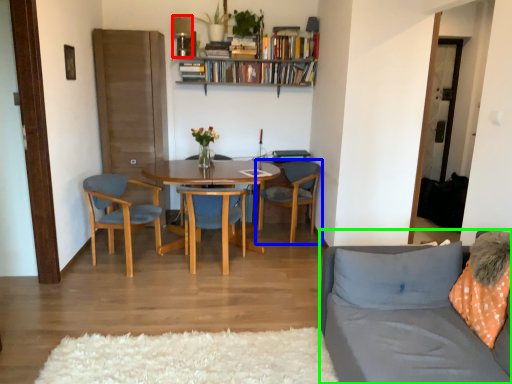
Question: Which object is positioned farthest from lamp (highlighted by a red box)? Select from chair (highlighted by a blue box) and studio couch (highlighted by a green box).

Choices:
 (A) chair
 (B) studio couch

Answer: (B)